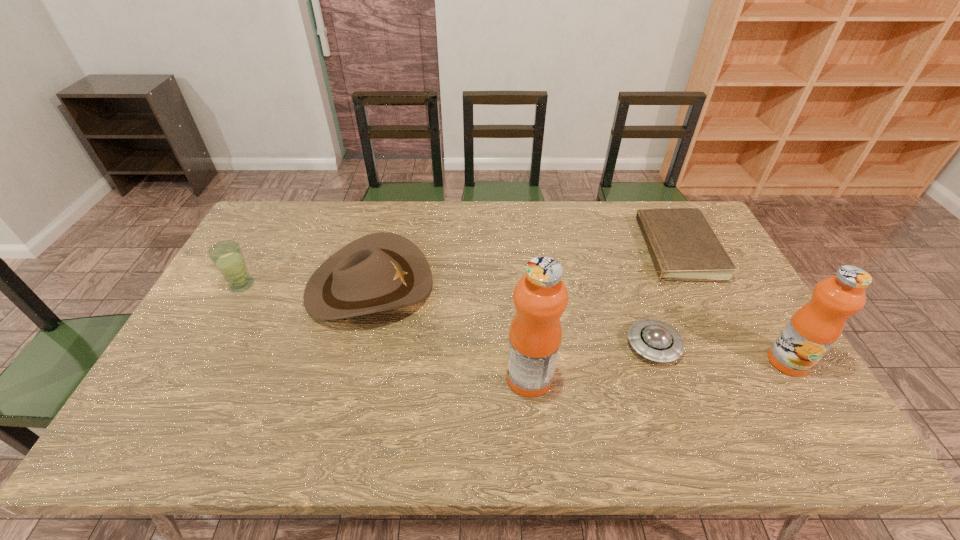
Locate an element on the screen. the fourth object from right to left is located at coordinates (540, 297).

Locate an element on the screen. Image resolution: width=960 pixels, height=540 pixels. the left fruit juice is located at coordinates (540, 297).

The width and height of the screenshot is (960, 540). I want to click on the right fruit juice, so click(814, 328).

The width and height of the screenshot is (960, 540). I want to click on the shorter fruit juice, so click(x=814, y=328).

The width and height of the screenshot is (960, 540). What are the coordinates of `the shortest object` in the screenshot? It's located at (683, 246).

Find the location of `cowboy hat`. cowboy hat is located at coordinates (383, 271).

Identify the location of glass. This screenshot has height=540, width=960. (227, 256).

Identify the location of saucer. (656, 340).

The width and height of the screenshot is (960, 540). What are the coordinates of `free location located on the back of the tallest object` in the screenshot? It's located at (524, 318).

Where is `vacant space located 0.110m on the left of the fifth shortest object`? The image size is (960, 540). vacant space located 0.110m on the left of the fifth shortest object is located at coordinates (727, 361).